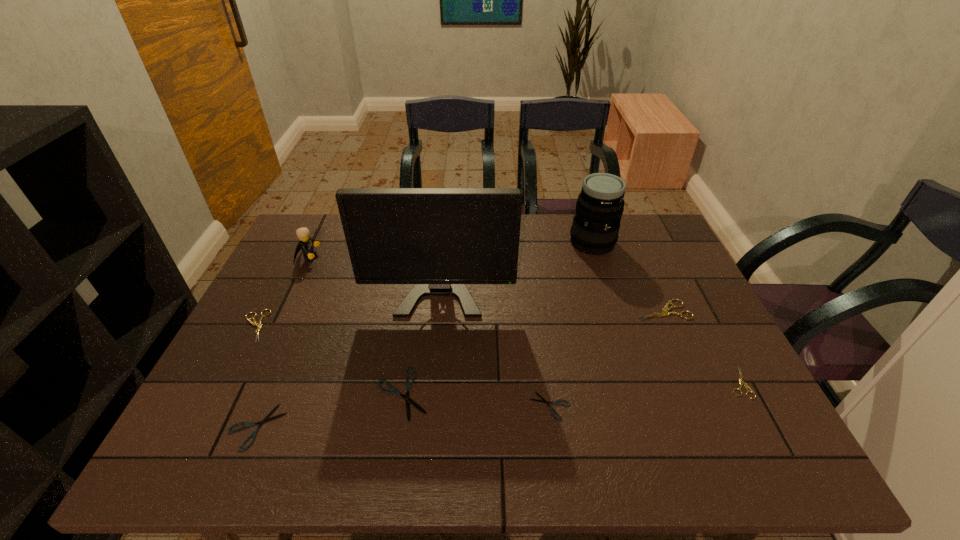
You are a GUI agent. You are given a task and a screenshot of the screen. Output one action in this format:
    pyautogui.click(x=<x>, y=<y>)
    Task: Click on the free space located on the left of the biggest black shears
    
    Given the screenshot: What is the action you would take?
    pyautogui.click(x=319, y=394)

The width and height of the screenshot is (960, 540). Find the location of `free space located on the left of the rightmost object`. free space located on the left of the rightmost object is located at coordinates (596, 383).

The width and height of the screenshot is (960, 540). In order to click on vacant point located 0.120m on the back of the second shears from left to right in this screenshot , I will do `click(283, 362)`.

Find the location of `free space located 0.310m on the left of the third shears from right to left`. free space located 0.310m on the left of the third shears from right to left is located at coordinates (392, 406).

In order to click on computer monitor at the far edge in this screenshot , I will do `click(439, 239)`.

Where is `telephoto lens that is positioned at the far edge`? The height and width of the screenshot is (540, 960). telephoto lens that is positioned at the far edge is located at coordinates (600, 205).

Identify the location of Lego that is at the far edge. This screenshot has width=960, height=540. (305, 244).

The image size is (960, 540). In order to click on object that is at the near edge in this screenshot , I will do `click(266, 419)`.

I want to click on Lego that is at the left edge, so (x=305, y=244).

I want to click on object positioned at the far left corner, so click(305, 244).